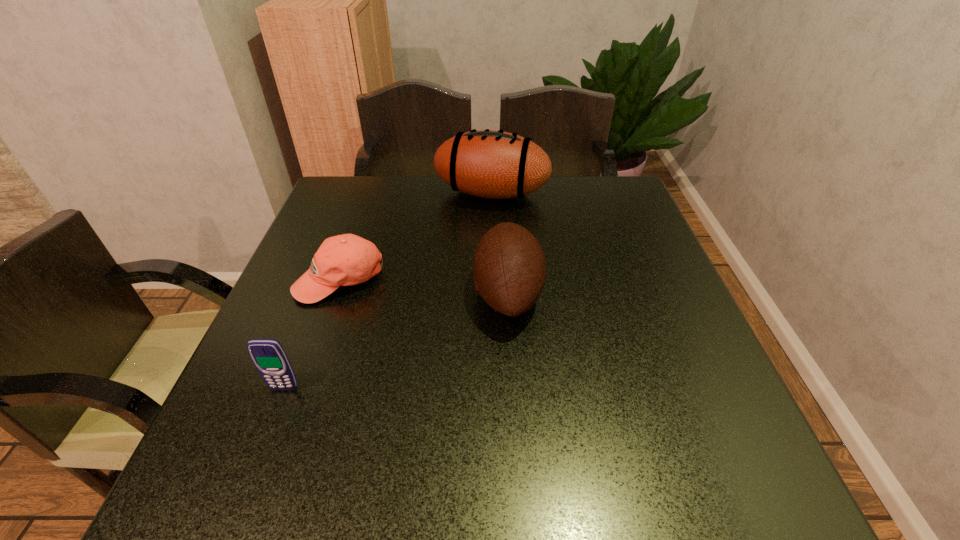
Locate an element on the screen. the tallest object is located at coordinates click(x=491, y=164).

Locate an element on the screen. This screenshot has width=960, height=540. the farther football is located at coordinates point(491,164).

At what (x,y) coordinates should I click in order to perform the action: click on the third shortest object. Please return your answer as a coordinate pair (x, y). The image size is (960, 540). Looking at the image, I should click on (509, 271).

Where is `the nearer football`? This screenshot has height=540, width=960. the nearer football is located at coordinates click(x=509, y=271).

At what (x,y) coordinates should I click in order to perform the action: click on the nearest object. Please return your answer as a coordinate pair (x, y). Looking at the image, I should click on (268, 355).

This screenshot has width=960, height=540. In order to click on the third tallest object in this screenshot , I will do `click(268, 355)`.

Locate an element on the screen. baseball cap is located at coordinates (343, 260).

At what (x,y) coordinates should I click in order to perform the action: click on vacant space located on the front of the farthest object. Please return your answer as a coordinate pair (x, y). The width and height of the screenshot is (960, 540). Looking at the image, I should click on (495, 310).

Where is `free location located 0.270m on the laces of the nearer football`? This screenshot has width=960, height=540. free location located 0.270m on the laces of the nearer football is located at coordinates (355, 293).

The image size is (960, 540). In order to click on blank space located on the laces of the nearer football in this screenshot , I will do pos(355,293).